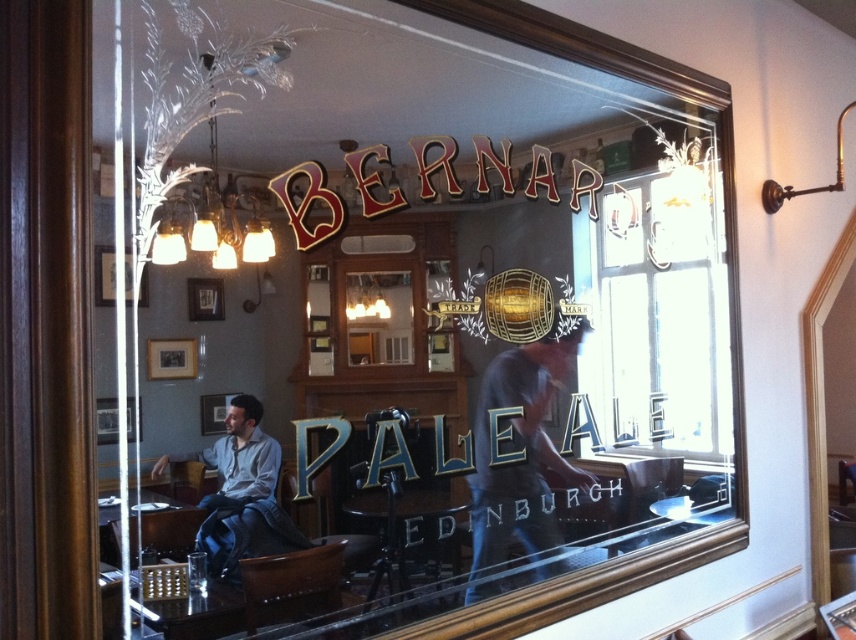
Is transparent glass window at center wider than dark blue jeans at center?

Indeed, transparent glass window at center has a greater width compared to dark blue jeans at center.

Who is higher up, transparent glass window at center or dark blue jeans at center?

transparent glass window at center

Does point (710, 440) come in front of point (550, 349)?

No.

The image size is (856, 640). I want to click on transparent glass window at center, so click(657, 314).